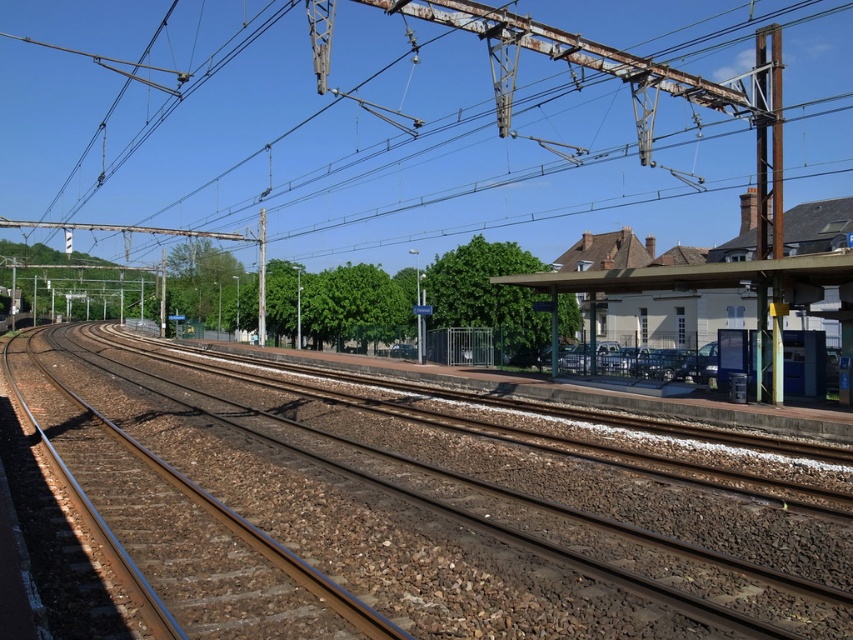
Question: Can you confirm if rusty metal power lines at upper center is positioned to the right of white painted platform at right?

Choices:
 (A) no
 (B) yes

Answer: (A)

Question: Which of the following is the farthest from the observer?

Choices:
 (A) brown gravel train track at center
 (B) rusty metal power lines at upper center

Answer: (B)

Question: Is brown gravel train track at center below white painted platform at right?

Choices:
 (A) no
 (B) yes

Answer: (B)

Question: Does rusty metal power lines at upper center appear over white painted platform at right?

Choices:
 (A) no
 (B) yes

Answer: (B)

Question: Which of the following is the farthest from the observer?

Choices:
 (A) (614, 269)
 (B) (610, 0)

Answer: (B)

Question: Among these objects, which one is nearest to the camera?

Choices:
 (A) white painted platform at right
 (B) brown gravel train track at center
 (C) rusty metal power lines at upper center

Answer: (B)